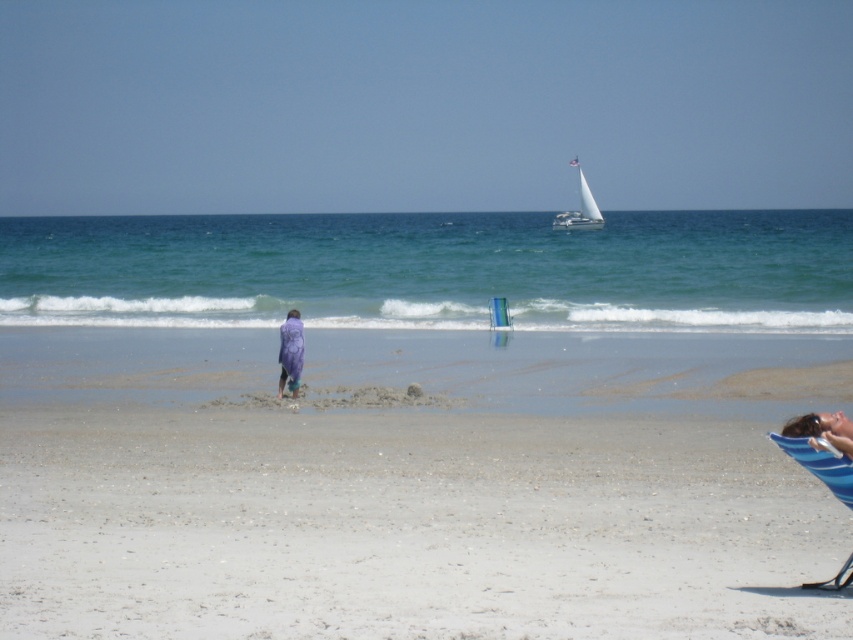
You are a photographer trying to capture the white sailboat at upper center and the transparent plastic chair at center in the same frame. Based on their positions, which object should you adjust your camera to focus on first to ensure both are in the shot?

The white sailboat at upper center is positioned on the right side of transparent plastic chair at center, so you should focus on the transparent plastic chair at center first to ensure both are in the frame.

In the scene shown: You are standing at the beach and want to take a photo of the two points marked in the scene. Which point, point 1 at coordinates point (848, 291) or point 2 at coordinates point (285, 384), is closer to you so that I can focus the camera properly?

Point 2 at coordinates point (285, 384) is closer to you, so you should focus the camera on that point first.

You are standing on the beach and want to reach the point marked at coordinates (494,230). If you walk straight towards it, how far will you have to walk?

The point marked at coordinates (494,230) is 321.57 feet away from the viewer, so you will have to walk 321.57 feet to reach it.